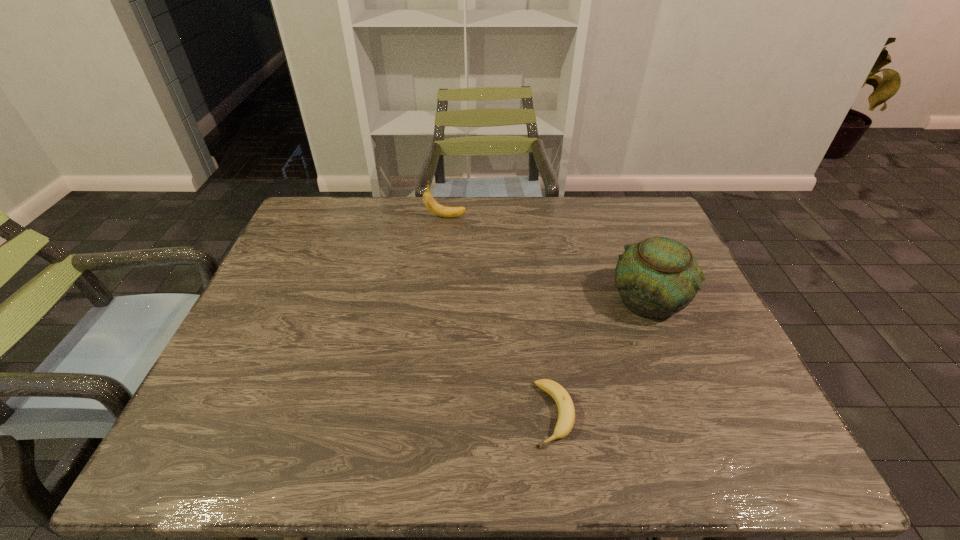
Find the location of a particular element. vacant space that satisfies the following two spatial constraints: 1. on the back side of the rightmost object; 2. at the start of the peel on the taller banana is located at coordinates (615, 217).